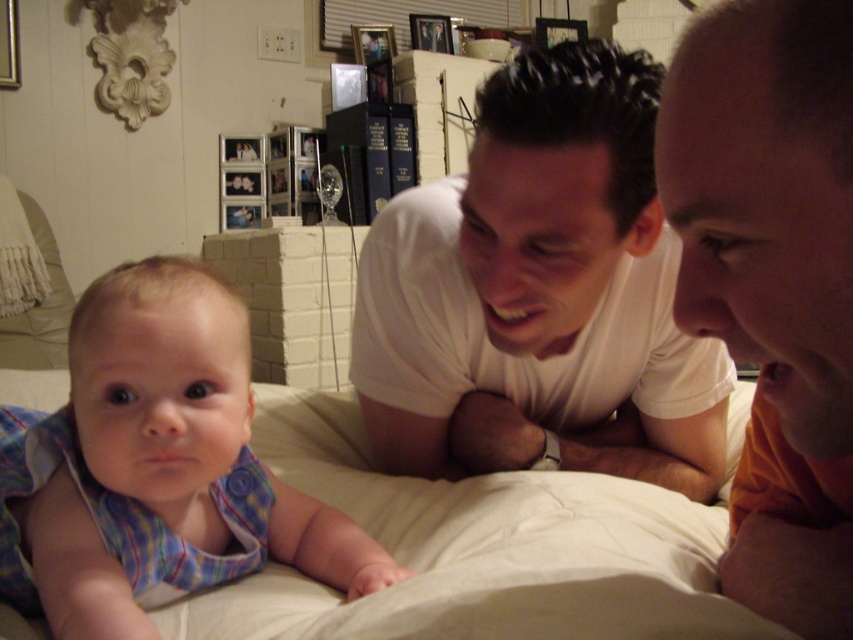
Who is lower down, white smooth t-shirt at center or white soft bed at center?

white soft bed at center is lower down.

Is white smooth t-shirt at center smaller than white soft bed at center?

No, white smooth t-shirt at center is not smaller than white soft bed at center.

Measure the distance between point [590,358] and camera.

The distance of point [590,358] from camera is 3.60 feet.

Locate an element on the screen. The image size is (853, 640). white smooth t-shirt at center is located at coordinates (540, 292).

Can you confirm if white matte shirt at upper center is smaller than white soft bed at center?

Correct, white matte shirt at upper center occupies less space than white soft bed at center.

How much distance is there between white matte shirt at upper center and white soft bed at center?

10.42 inches

Between point (830, 24) and point (312, 484), which one is positioned in front?

Point (830, 24) is more forward.

At what (x,y) coordinates should I click in order to perform the action: click on white matte shirt at upper center. Please return your answer as a coordinate pair (x, y). This screenshot has width=853, height=640. Looking at the image, I should click on (773, 282).

Is white matte shirt at upper center positioned behind plaid fabric baby at lower left?

No, white matte shirt at upper center is in front of plaid fabric baby at lower left.

Does white matte shirt at upper center lie in front of plaid fabric baby at lower left?

Yes, white matte shirt at upper center is closer to the viewer.

Where is `white matte shirt at upper center`? The image size is (853, 640). white matte shirt at upper center is located at coordinates click(x=773, y=282).

Identify the location of white matte shirt at upper center. The image size is (853, 640). (773, 282).